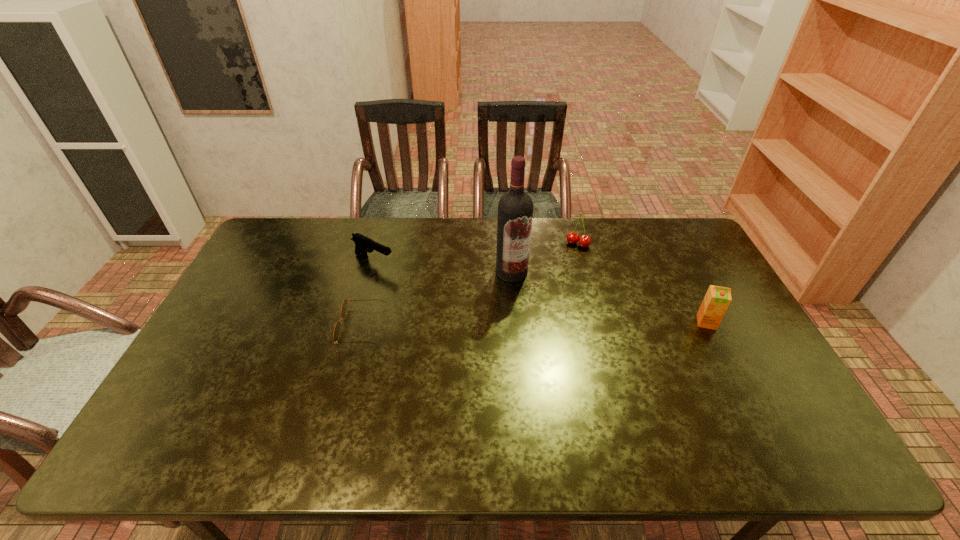
Image resolution: width=960 pixels, height=540 pixels. What are the coordinates of `vacant spot on the desktop that is between the sunglasses and the rightmost object and is positioned on the front-facing side of the pistol` in the screenshot? It's located at (502, 325).

You are a GUI agent. You are given a task and a screenshot of the screen. Output one action in this format:
    pyautogui.click(x=<x>, y=<y>)
    Task: Click on the free space on the desktop that is between the sunglasses and the second tallest object and is positioned with the stems of the second object from right to left pointing upwards
    The image size is (960, 540).
    Given the screenshot: What is the action you would take?
    pyautogui.click(x=536, y=324)

The image size is (960, 540). What are the coordinates of `free space on the desktop that is between the shortest object and the rightmost object and is positioned on the label of the wine bottle` in the screenshot? It's located at (517, 325).